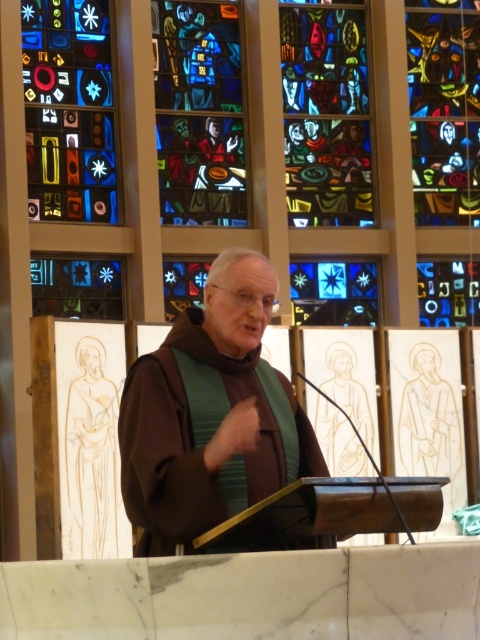
Question: From the image, what is the correct spatial relationship of multicolored stained glass at upper left in relation to stained glass window at center?

Choices:
 (A) right
 (B) left

Answer: (B)

Question: Which of these objects is positioned farthest from the multicolored stained glass at upper left?

Choices:
 (A) brown velvety robe at center
 (B) multicolored stained glass at upper right
 (C) stained glass window at center

Answer: (A)

Question: Which object is farther from the camera taking this photo?

Choices:
 (A) multicolored stained glass at upper left
 (B) multicolored stained glass at upper right
 (C) multicolored stained glass at center

Answer: (B)

Question: Is brown velvety robe at center thinner than stained glass window at center?

Choices:
 (A) no
 (B) yes

Answer: (B)

Question: Does stained glass window at center have a smaller size compared to multicolored stained glass at upper right?

Choices:
 (A) yes
 (B) no

Answer: (A)

Question: Which object is closer to the camera taking this photo?

Choices:
 (A) multicolored stained glass at center
 (B) multicolored stained glass at upper left
 (C) stained glass window at center

Answer: (B)